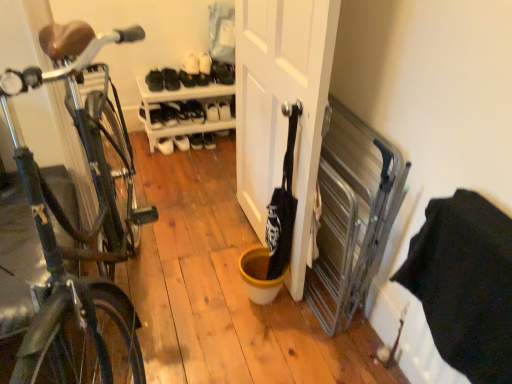
Question: Is point (201, 110) closer or farther from the camera than point (222, 112)?

Choices:
 (A) farther
 (B) closer

Answer: (B)

Question: Is white matte shoe at upper center, the 4th shoe positioned from the right, wider or thinner than white matte shoe at upper center, the first shoe viewed from the right?

Choices:
 (A) wide
 (B) thin

Answer: (B)

Question: Which is nearer to the white matte shoe at upper center, marked as the third shoe in a right-to-left arrangement?

Choices:
 (A) white leather shoe at center, positioned as the first shoe in left-to-right order
 (B) white matte door at center
 (C) white plastic shoe rack at center
 (D) black leather shoe at upper center, which is the sixth shoe from left to right
 (E) shiny black bicycle at left

Answer: (D)

Question: Which of these objects is positioned farthest from the white matte shoe at upper center, the fourth shoe from the left?

Choices:
 (A) white plastic shoe rack at center
 (B) shiny black bicycle at left
 (C) white matte shoe at upper center, the first shoe viewed from the right
 (D) white matte door at center
 (E) black leather shoe at upper center, which is the sixth shoe from left to right

Answer: (B)